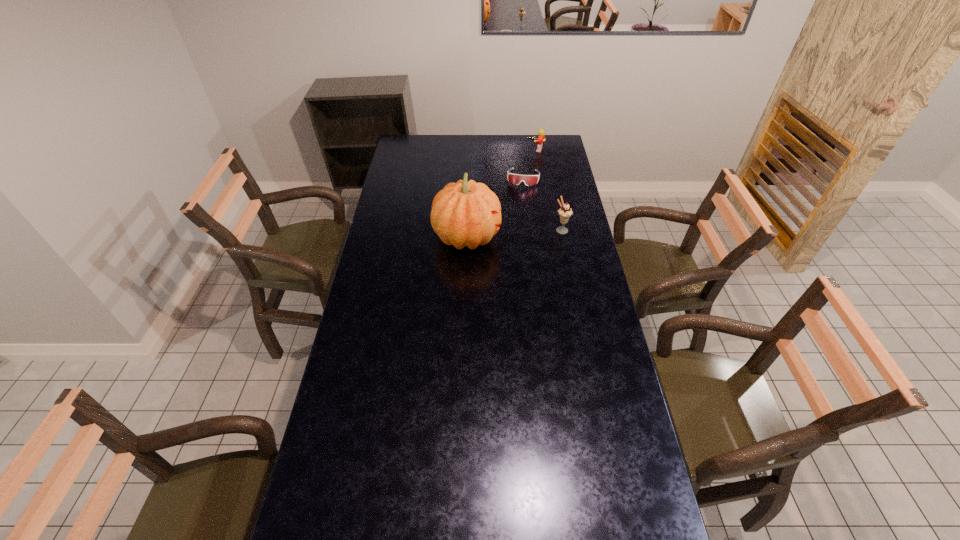
I want to click on pumpkin, so click(x=464, y=213).

Identify the location of the leftmost object. The image size is (960, 540). (464, 213).

In order to click on the second tallest object in this screenshot , I will do `click(565, 212)`.

I want to click on Lego, so click(541, 137).

What are the coordinates of `the farthest object` in the screenshot? It's located at (541, 137).

Locate an element on the screen. This screenshot has width=960, height=540. the shortest object is located at coordinates (529, 180).

Locate an element on the screen. This screenshot has width=960, height=540. goggles is located at coordinates (529, 180).

The image size is (960, 540). I want to click on free space located on the carved face of the tallest object, so click(x=542, y=237).

In order to click on free space located on the front of the icecream in this screenshot , I will do `click(572, 283)`.

Where is `free spot located in front of the third tallest object with the accessory visible`? The height and width of the screenshot is (540, 960). free spot located in front of the third tallest object with the accessory visible is located at coordinates (531, 158).